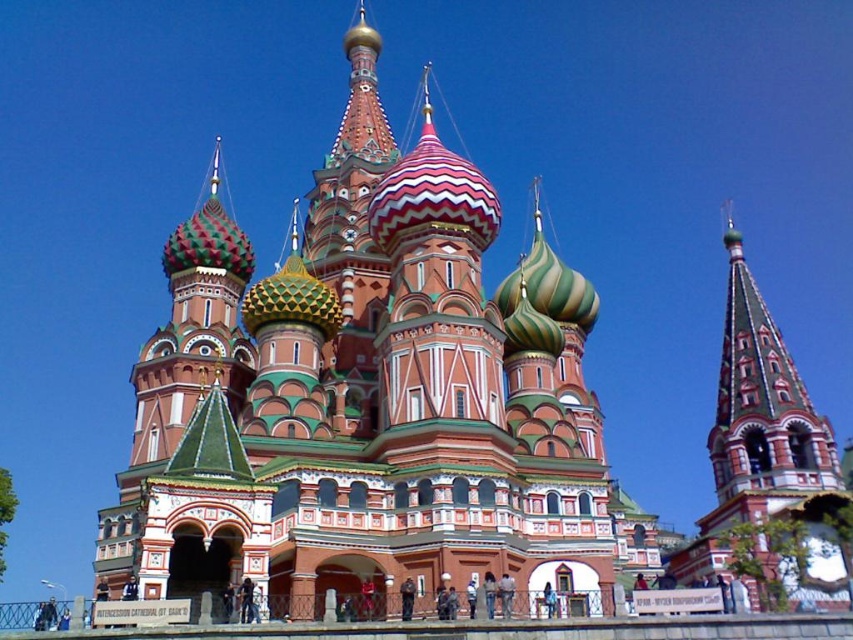
Between point (299, 336) and point (813, 484), which one is positioned behind?

The point (813, 484) is behind.

The height and width of the screenshot is (640, 853). What are the coordinates of `polychrome woodwork church at center` in the screenshot? It's located at (368, 397).